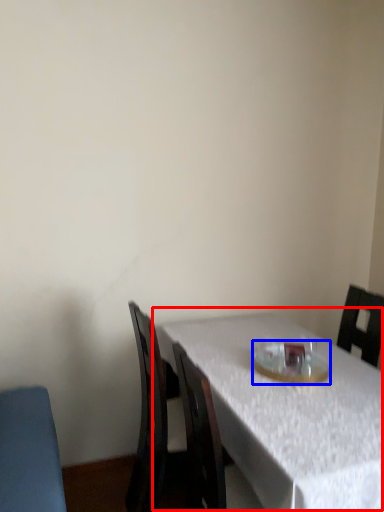
Question: Which object is further to the camera taking this photo, table (highlighted by a red box) or tableware (highlighted by a blue box)?

Choices:
 (A) table
 (B) tableware

Answer: (B)